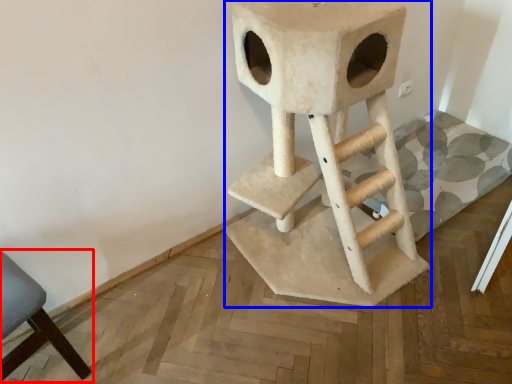
Question: Which object is further to the camera taking this photo, chair (highlighted by a red box) or bar stool (highlighted by a blue box)?

Choices:
 (A) chair
 (B) bar stool

Answer: (A)